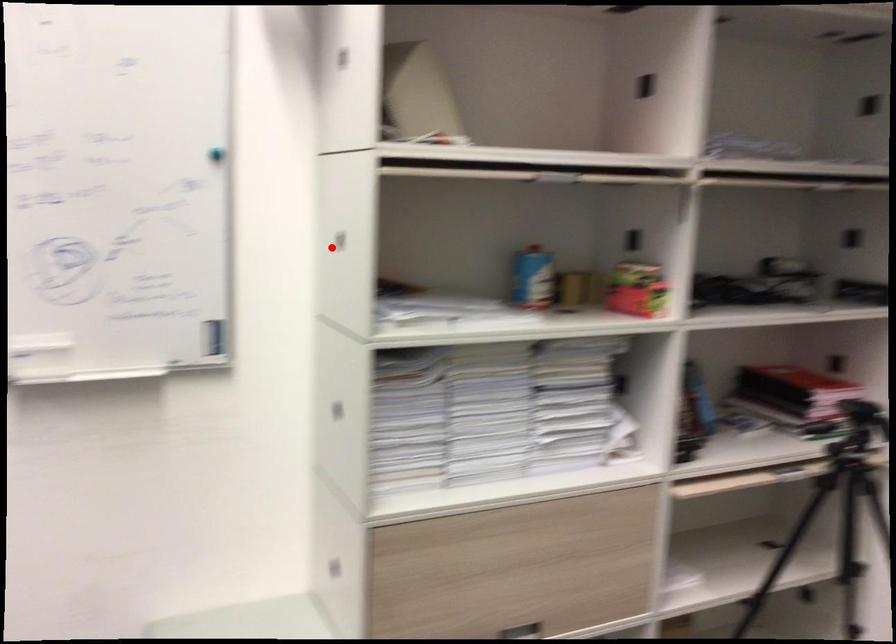
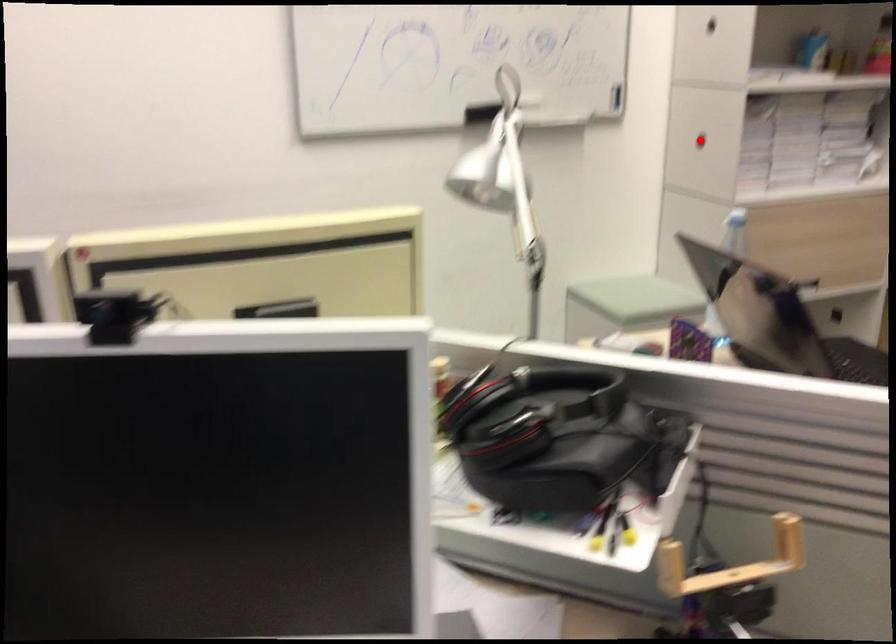
I am providing you with two images of the same scene from different viewpoints. A red point is marked on the first image and another point is marked on the second image. Do the highlighted points in image1 and image2 indicate the same real-world spot?

No